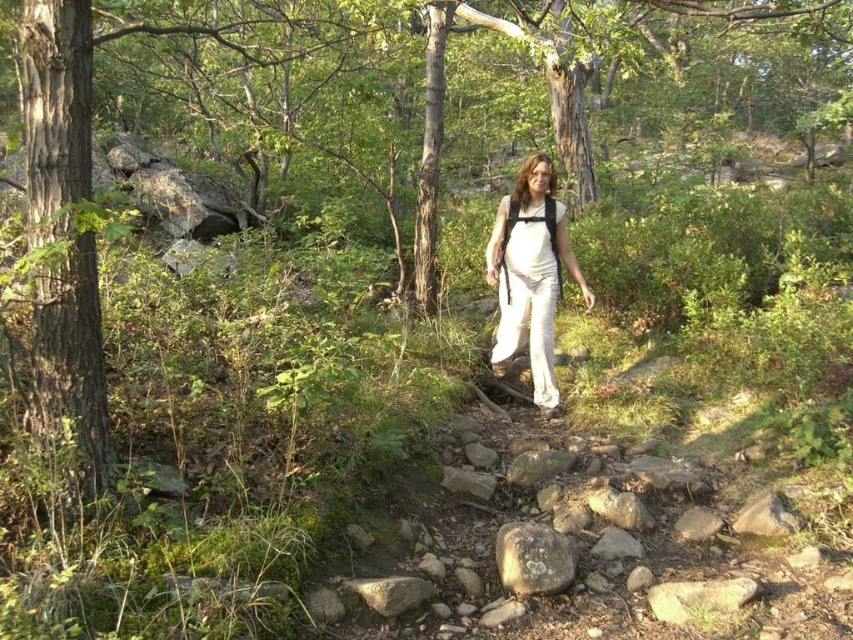
Does point (50, 266) come farther from viewer compared to point (515, 528)?

No.

What do you see at coordinates (62, 236) in the screenshot?
I see `smooth brown tree trunk at left` at bounding box center [62, 236].

Image resolution: width=853 pixels, height=640 pixels. In order to click on smooth brown tree trunk at left in this screenshot , I will do `click(62, 236)`.

Is smooth brown tree trunk at left further to the viewer compared to white cotton pants at center?

No, it is not.

Does smooth brown tree trunk at left have a larger size compared to white cotton pants at center?

Incorrect, smooth brown tree trunk at left is not larger than white cotton pants at center.

Who is more forward, (44,138) or (538,177)?

Positioned in front is point (44,138).

Where is `smooth brown tree trunk at left`? smooth brown tree trunk at left is located at coordinates (62, 236).

Between point (549, 220) and point (548, 586), which one is positioned in front?

Point (548, 586) is more forward.

Where is `white cotton pants at center`? white cotton pants at center is located at coordinates (531, 273).